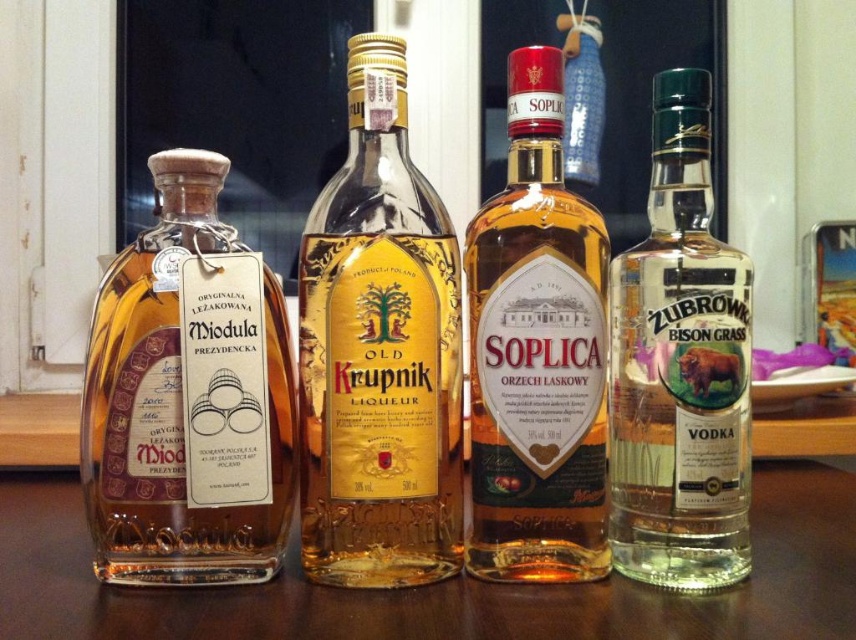
Question: Among these points, which one is nearest to the camera?

Choices:
 (A) (10, 509)
 (B) (616, 317)
 (C) (82, 424)

Answer: (C)

Question: Does transparent glass bottles at center appear under clear glass vodka at right?

Choices:
 (A) yes
 (B) no

Answer: (A)

Question: Does gold glass bottle at center have a smaller size compared to transparent glass bottles at center?

Choices:
 (A) no
 (B) yes

Answer: (B)

Question: Among these objects, which one is farthest from the camera?

Choices:
 (A) amber glass bottle at left
 (B) clear glass vodka at right

Answer: (B)

Question: Can you confirm if amber glass bottle at left is wider than amber glass bottle at center?

Choices:
 (A) yes
 (B) no

Answer: (A)

Question: Estimate the real-world distances between objects in this image. Which object is closer to the amber glass bottle at left?

Choices:
 (A) gold glass bottle at center
 (B) clear glass vodka at right
 (C) amber glass bottle at center

Answer: (A)